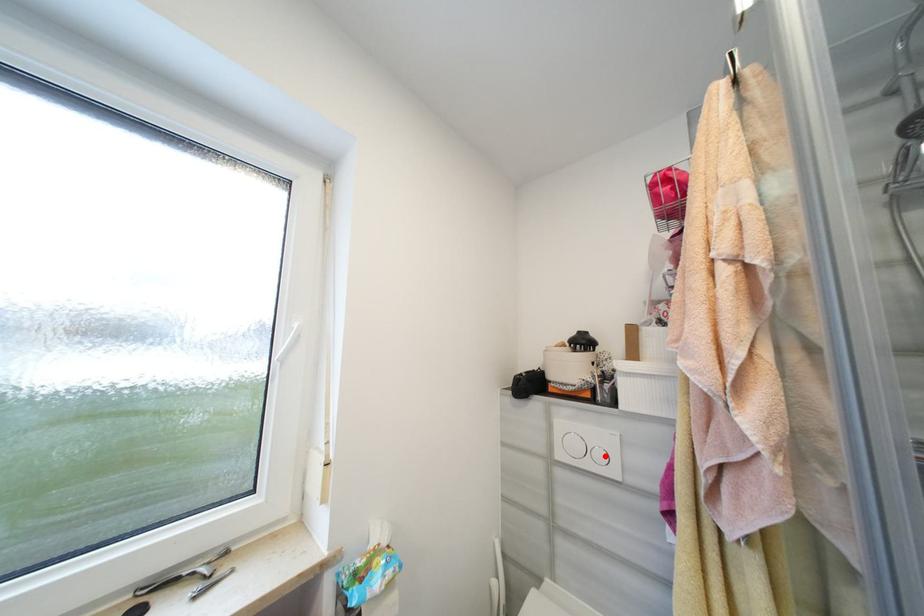
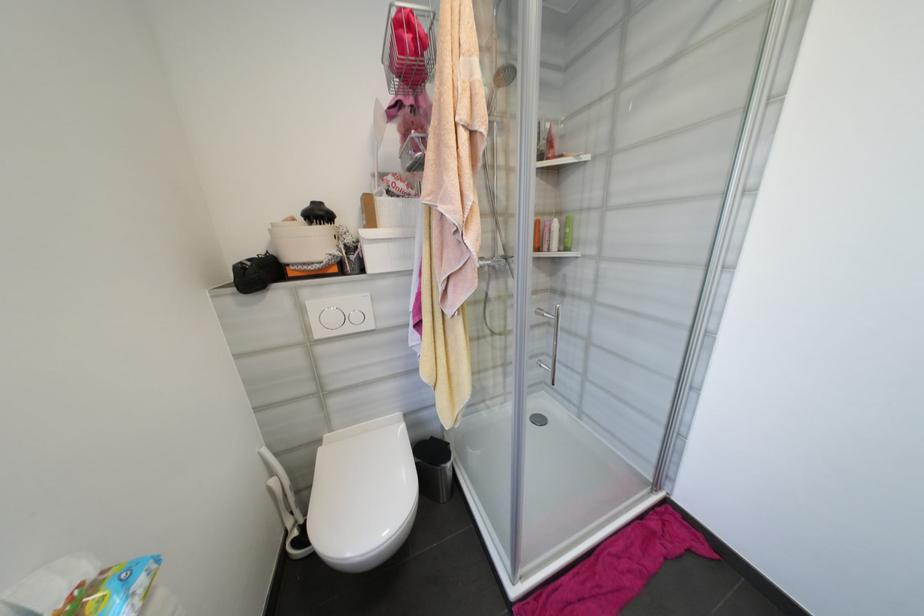
Where in the second image is the point corresponding to the highlighted location from the first image?

(361, 318)